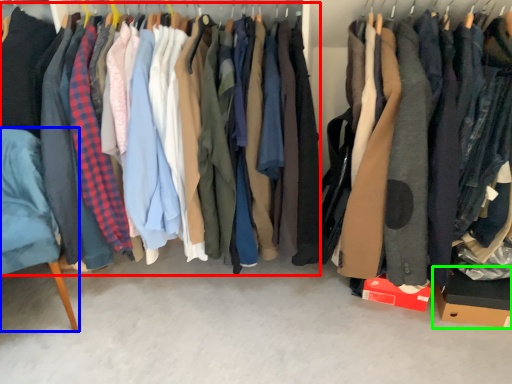
Question: Based on their relative distances, which object is farther from closet (highlighted by a red box)? Choose from furniture (highlighted by a blue box) and cardboard box (highlighted by a green box).

Choices:
 (A) furniture
 (B) cardboard box

Answer: (B)